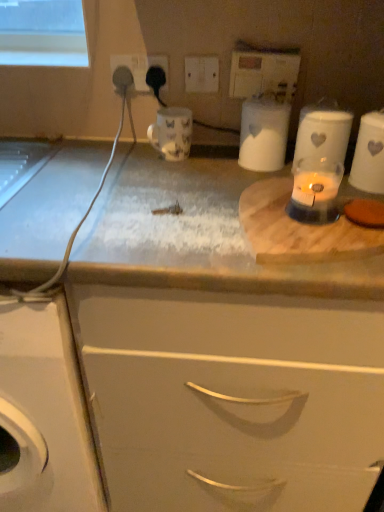
Locate an element on the screen. The width and height of the screenshot is (384, 512). vacant area that is situated to the right of matte ceramic mug at center, which is counted as the first appliance, starting from the left is located at coordinates (223, 163).